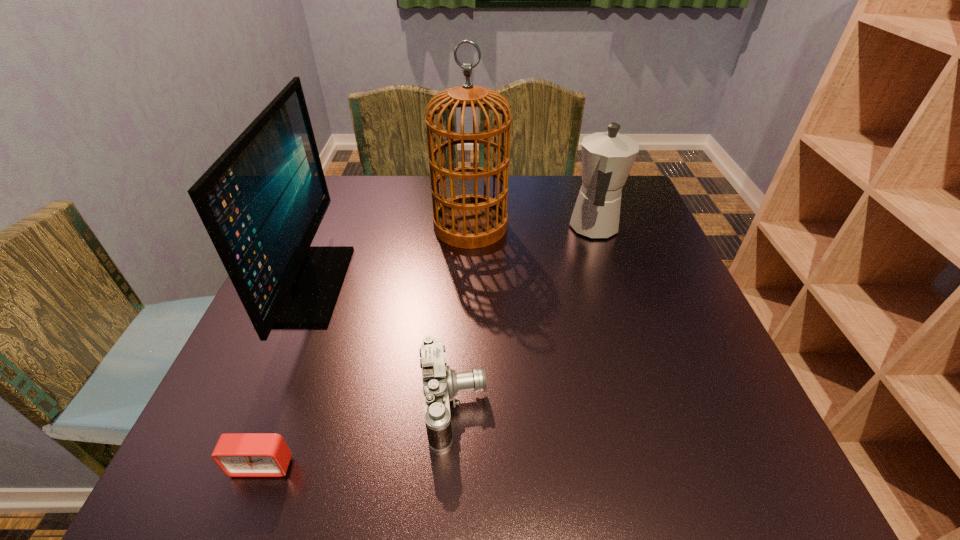
The image size is (960, 540). What are the coordinates of `free point between the second shortest object and the third tallest object` in the screenshot? It's located at (524, 316).

Where is `free area in between the shortest object and the birdcage`? The image size is (960, 540). free area in between the shortest object and the birdcage is located at coordinates (367, 346).

This screenshot has width=960, height=540. Identify the location of free space between the alarm clock and the tallest object. (367, 346).

Identify the location of unoccupied area between the fourth shortest object and the shortest object. Image resolution: width=960 pixels, height=540 pixels. (285, 375).

The width and height of the screenshot is (960, 540). Find the location of `object that is the third nearest to the third tallest object`. object that is the third nearest to the third tallest object is located at coordinates (262, 201).

What are the coordinates of `object that is the closest one to the fourth shortest object` in the screenshot? It's located at (237, 454).

What are the coordinates of `vacant region that satisfies the following two spatial constraints: 1. at the lens of the fourth tallest object; 2. on the front-facing side of the alarm clock` in the screenshot? It's located at click(450, 464).